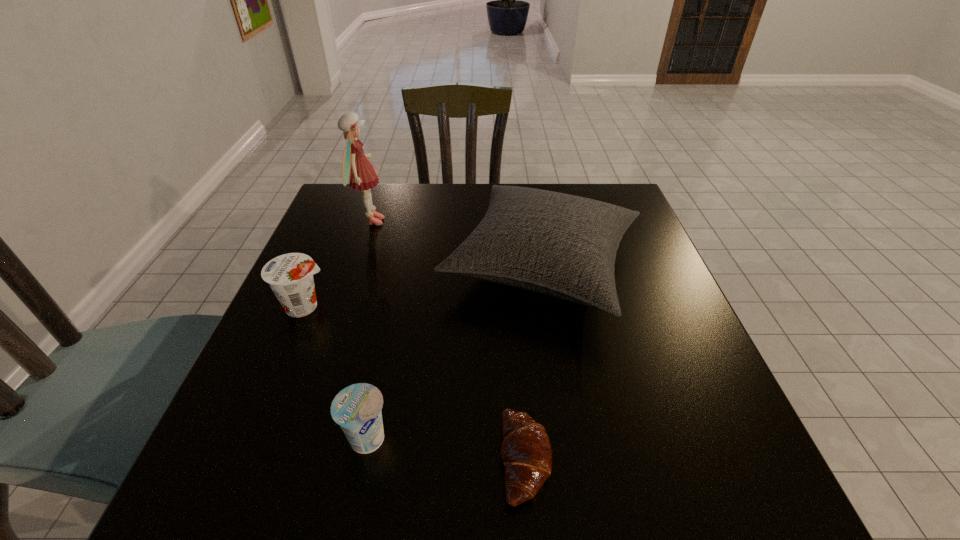
Identify the location of vacant space located on the right of the crescent roll. Image resolution: width=960 pixels, height=540 pixels. (716, 459).

You are a GUI agent. You are given a task and a screenshot of the screen. Output one action in this format:
    pyautogui.click(x=<x>, y=<y>)
    Task: Click on the doll that is at the far edge
    
    Given the screenshot: What is the action you would take?
    pyautogui.click(x=356, y=167)

I want to click on cushion located in the far edge section of the desktop, so click(x=561, y=245).

At what (x,y) coordinates should I click in order to perform the action: click on yogurt located at the near edge. Please return your answer as a coordinate pair (x, y). This screenshot has height=540, width=960. Looking at the image, I should click on (357, 408).

Where is `crescent roll that is at the near edge`? This screenshot has height=540, width=960. crescent roll that is at the near edge is located at coordinates (526, 453).

Identify the location of doll that is positioned at the left edge. 356,167.

Image resolution: width=960 pixels, height=540 pixels. Find the location of `yogurt at the left edge`. yogurt at the left edge is located at coordinates (290, 276).

Locate an element on the screen. This screenshot has width=960, height=540. object that is positioned at the right edge is located at coordinates pos(561,245).

Locate an element on the screen. The width and height of the screenshot is (960, 540). object at the far left corner is located at coordinates pos(356,167).

The width and height of the screenshot is (960, 540). I want to click on object at the far right corner, so click(x=561, y=245).